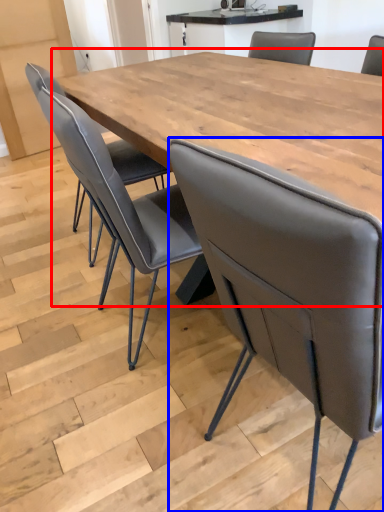
Question: Which of the following is the closest to the observer, table (highlighted by a red box) or chair (highlighted by a blue box)?

Choices:
 (A) table
 (B) chair

Answer: (B)